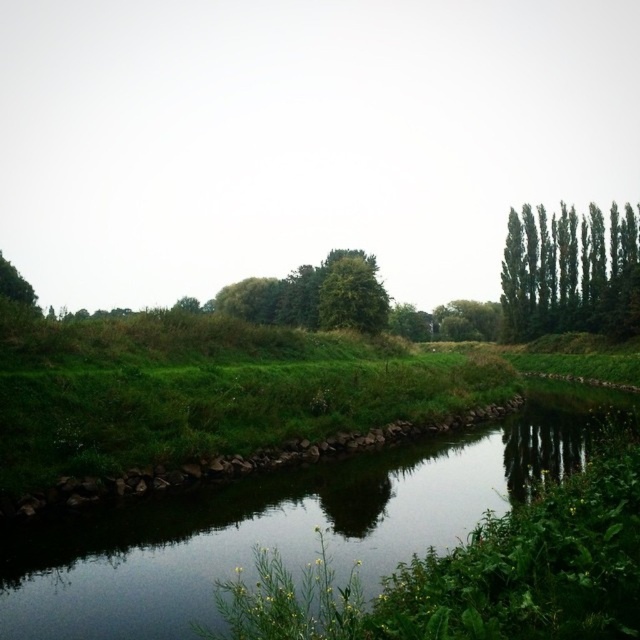
Question: Does green grassy river at center appear on the left side of green leafy trees at right?

Choices:
 (A) no
 (B) yes

Answer: (B)

Question: Can you confirm if green grassy river at center is positioned below green leafy tree at upper left?

Choices:
 (A) yes
 (B) no

Answer: (A)

Question: Among these objects, which one is farthest from the camera?

Choices:
 (A) green leafy tree at upper left
 (B) green grassy river at center
 (C) green leafy trees at right

Answer: (C)

Question: Based on their relative distances, which object is nearer to the green leafy tree at upper left?

Choices:
 (A) green leafy tree at center
 (B) green grassy river at center

Answer: (B)

Question: Where is green leafy trees at right located in relation to green leafy tree at upper left in the image?

Choices:
 (A) above
 (B) below

Answer: (A)

Question: Which object is positioned farthest from the green grassy river at center?

Choices:
 (A) green leafy tree at center
 (B) green leafy tree at upper left

Answer: (A)